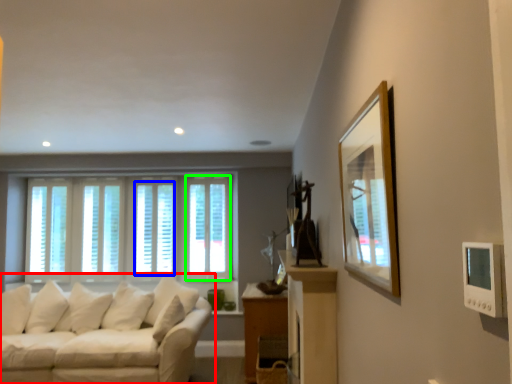
Question: Based on their relative distances, which object is nearer to studio couch (highlighted by a red box)? Choose from window (highlighted by a blue box) and window (highlighted by a green box).

Choices:
 (A) window
 (B) window

Answer: (A)